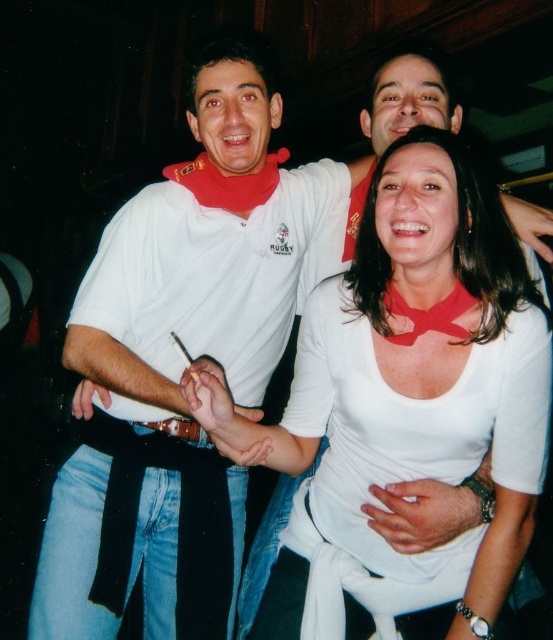
Between white matte shirt at center and brown leather belt at lower center, which one appears on the right side from the viewer's perspective?

white matte shirt at center is more to the right.

Can you confirm if white matte shirt at center is bigger than brown leather belt at lower center?

Yes.

Does point (393, 269) come in front of point (199, 435)?

Yes.

What are the coordinates of `white matte shirt at center` in the screenshot? It's located at (404, 404).